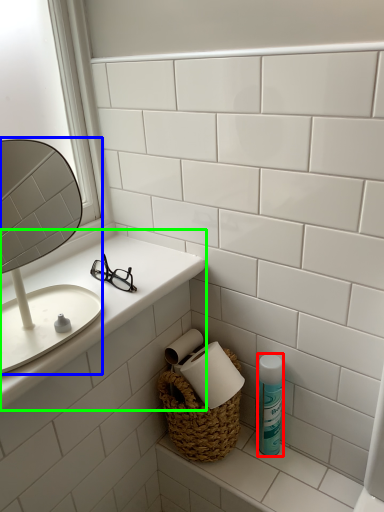
Question: Considering the real-world distances, which object is closest to mouthwash (highlighted by a red box)? mirror (highlighted by a blue box) or counter top (highlighted by a green box).

Choices:
 (A) mirror
 (B) counter top

Answer: (B)